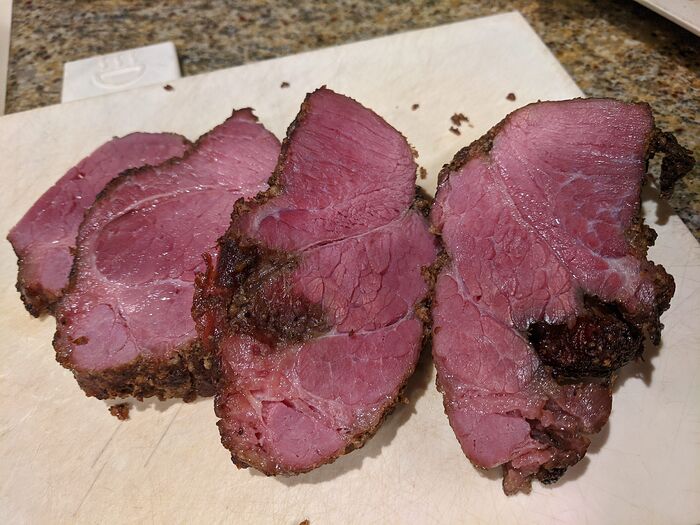
This screenshot has height=525, width=700. I want to click on board, so point(419,464).